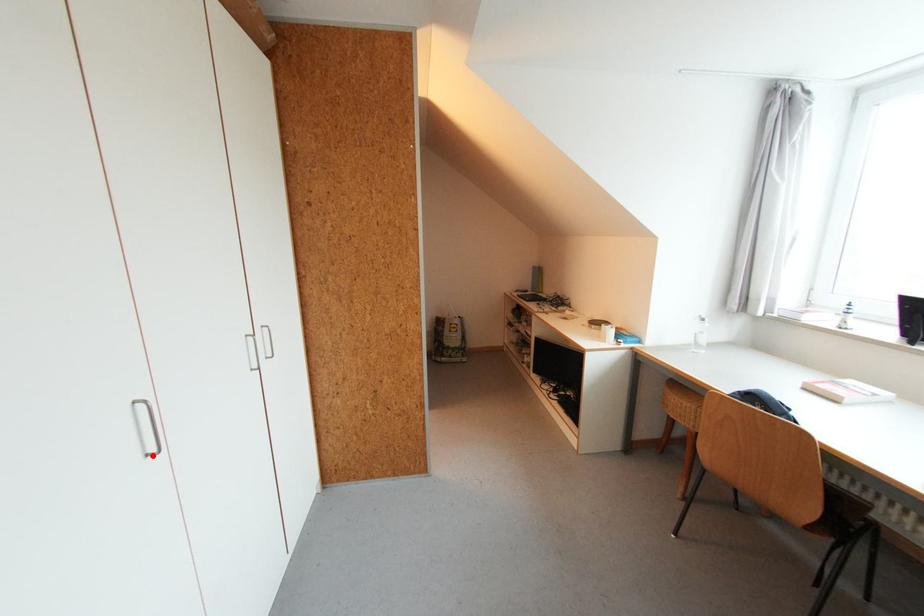
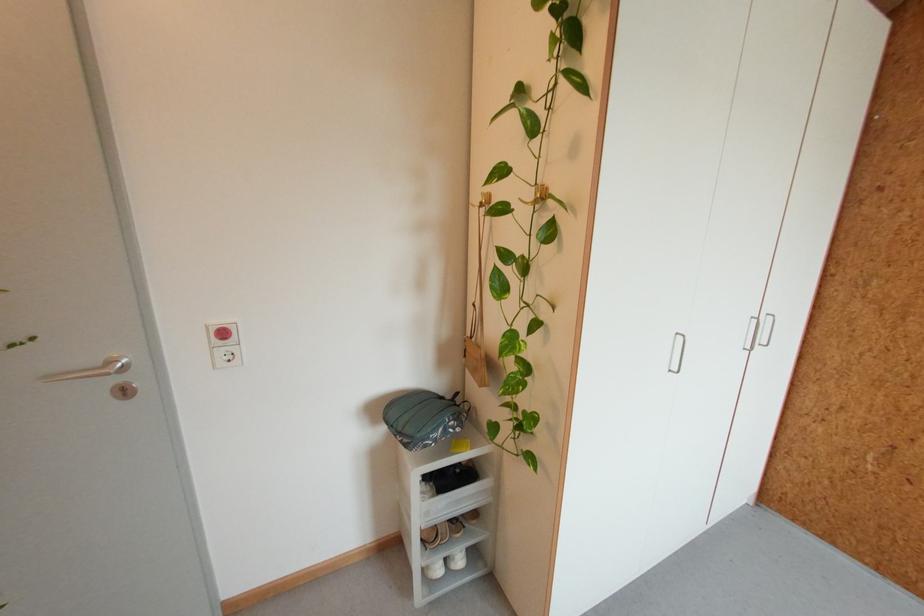
Locate, in the second image, the point that corresponds to the highlighted location in the first image.

(675, 371)